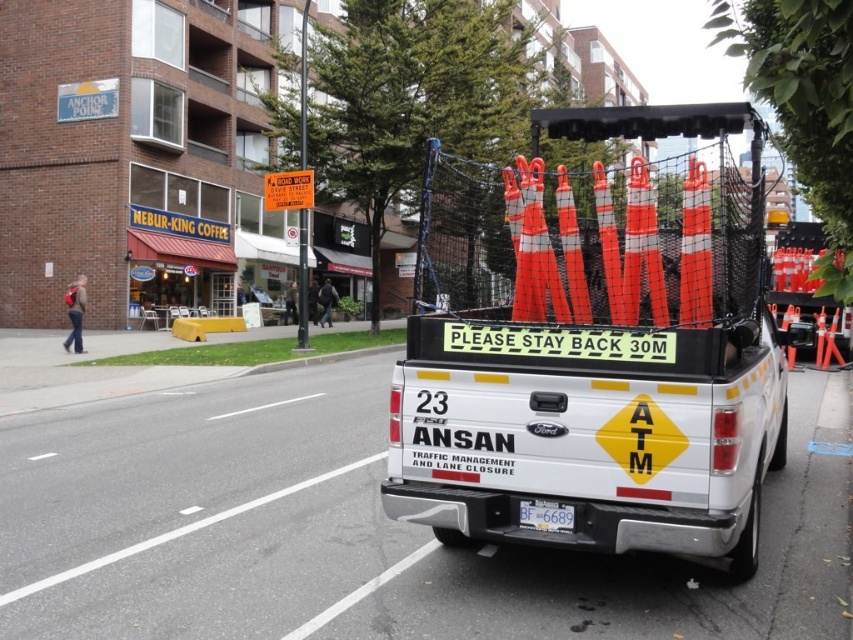
Question: Which point appears farthest from the camera in this image?

Choices:
 (A) (529, 515)
 (B) (587, 394)

Answer: (A)

Question: Does orange reflective traffic cones at rear appear under white plastic license plate at center?

Choices:
 (A) no
 (B) yes

Answer: (A)

Question: Which object appears closest to the camera in this image?

Choices:
 (A) white plastic license plate at center
 (B) orange reflective traffic cones at rear

Answer: (B)

Question: Is orange reflective traffic cones at rear above white plastic license plate at center?

Choices:
 (A) yes
 (B) no

Answer: (A)

Question: Which of the following is the farthest from the observer?

Choices:
 (A) orange reflective traffic cones at rear
 (B) white plastic license plate at center

Answer: (B)

Question: Is orange reflective traffic cones at rear bigger than white plastic license plate at center?

Choices:
 (A) yes
 (B) no

Answer: (A)